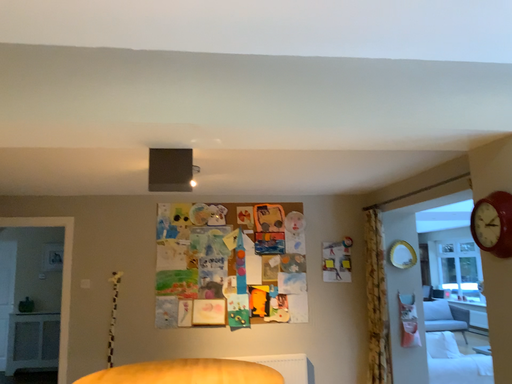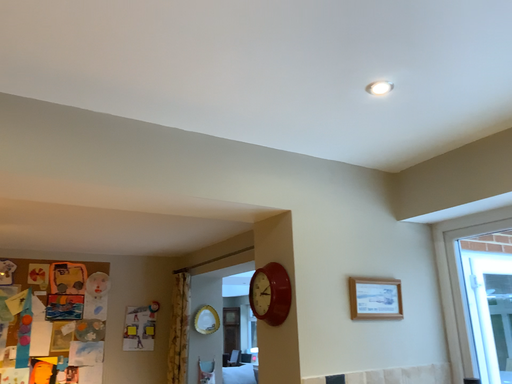
Question: Which way did the camera rotate in the video?

Choices:
 (A) rotated right
 (B) rotated left

Answer: (A)